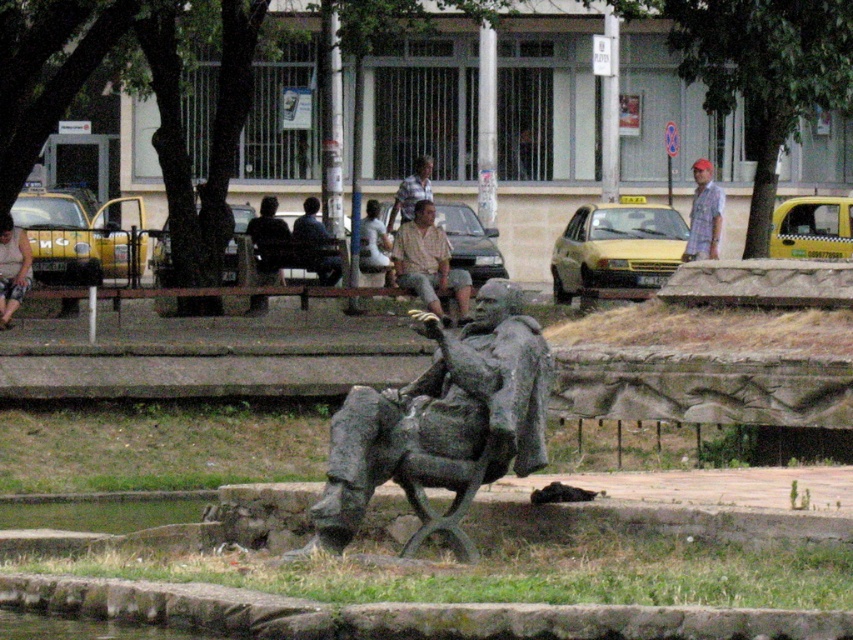
Is point (426, 259) closer to viewer compared to point (392, 227)?

Yes, point (426, 259) is in front of point (392, 227).

Based on the photo, is matte brown shirt at center to the right of light brown fabric shirt at center from the viewer's perspective?

Correct, you'll find matte brown shirt at center to the right of light brown fabric shirt at center.

Is point (461, 282) more distant than point (426, 173)?

No, (461, 282) is closer to viewer.

Where is `matte brown shirt at center`? This screenshot has width=853, height=640. matte brown shirt at center is located at coordinates (428, 260).

Does bronze statue at center appear under matte black shirt at left?

Correct, bronze statue at center is located below matte black shirt at left.

Between bronze statue at center and matte black shirt at left, which one has less height?

matte black shirt at left is shorter.

Who is more forward, (451, 413) or (3, 308)?

→ Positioned in front is point (451, 413).

What are the coordinates of `bronze statue at center` in the screenshot? It's located at (440, 422).

Between point (306, 260) and point (277, 225), which one is positioned in front?

Point (306, 260) is more forward.

Identify the location of dark blue shirt at center. The image size is (853, 640). (314, 244).

Who is more distant from viewer, (323, 250) or (271, 273)?

Positioned behind is point (323, 250).

The width and height of the screenshot is (853, 640). What are the coordinates of `dark blue shirt at center` in the screenshot? It's located at (314, 244).